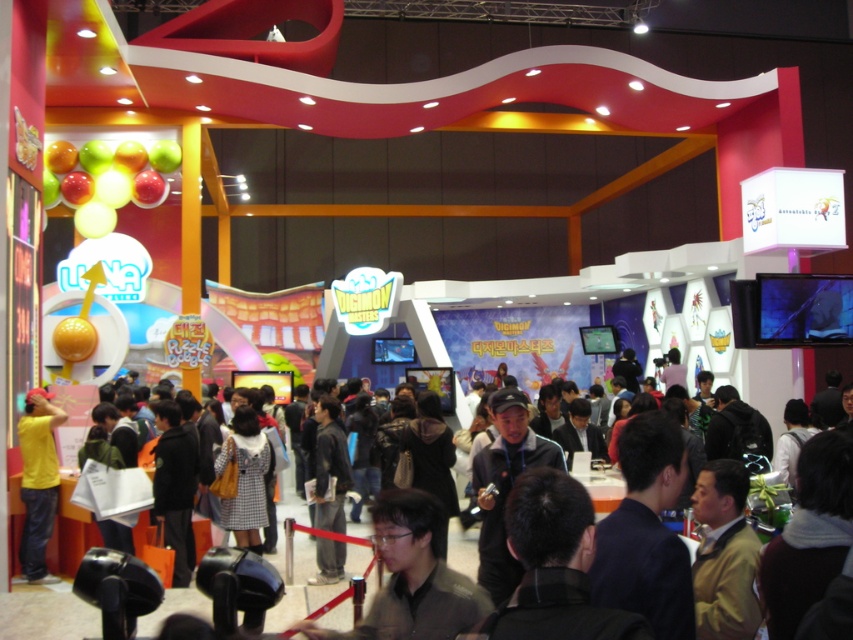
You are organizing a photo shoot and need to decide which clothing item to feature based on their sizes. Given the dark brown leather jacket at center and the yellow matte shirt at left, which one would you choose if you want the larger item in the frame?

The dark brown leather jacket at center is larger than the yellow matte shirt at left, so you should choose the dark brown leather jacket at center for the photo shoot to feature the larger item.

You are an event organizer checking the attendee attire for a photo shoot. You notice the dark brown leather jacket at center and the yellow matte shirt at left. Which clothing item is located lower in the image?

The dark brown leather jacket at center is positioned under the yellow matte shirt at left, so it is located lower in the image.

You are standing at the entrance of the convention hall and see two points marked in the image. The first point is at coordinates point (32, 625) and the second is at point (53, 426). Which point is closer to you?

Point (32, 625) is in front of point (53, 426), so it is closer to you.